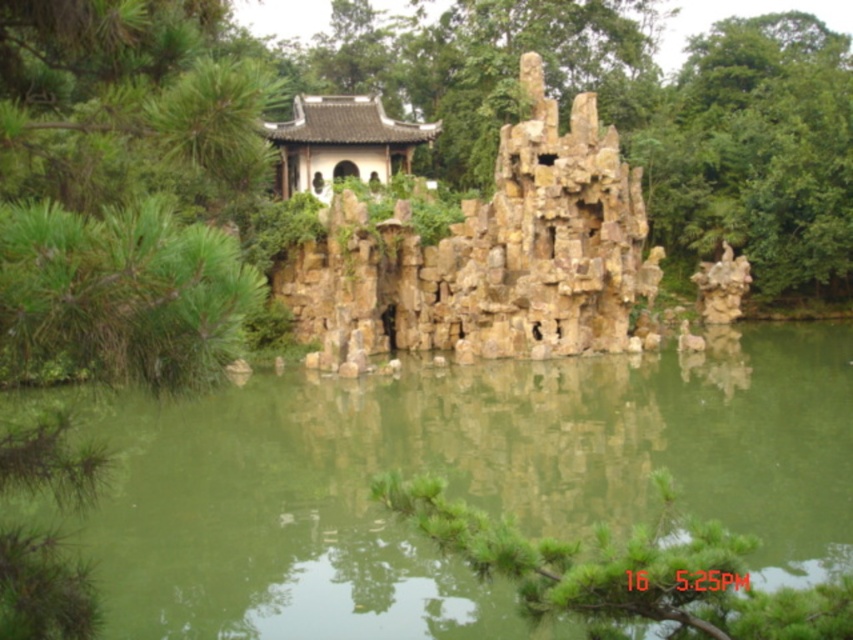
Which of these two, yellowish stone rock formation at center or green needle-like leaves at lower center, stands taller?

yellowish stone rock formation at center is taller.

Identify the location of yellowish stone rock formation at center. (489, 253).

Does point (358, 218) come closer to viewer compared to point (393, 477)?

No, (358, 218) is further to viewer.

In order to click on yellowish stone rock formation at center in this screenshot , I will do `click(489, 253)`.

Between point (318, 266) and point (219, 317), which one is positioned in front?

Point (219, 317) is in front.

Is the position of yellowish stone rock formation at center less distant than that of green leafy tree at left?

No, it is behind green leafy tree at left.

Which is in front, point (358, 225) or point (161, 289)?

Point (161, 289) is more forward.

Where is `yellowish stone rock formation at center`? yellowish stone rock formation at center is located at coordinates (489, 253).

Is green stone lake at center above green needle-like leaves at lower center?

Yes.

Identify the location of green stone lake at center. (450, 483).

The image size is (853, 640). Find the location of `green stone lake at center`. green stone lake at center is located at coordinates (450, 483).